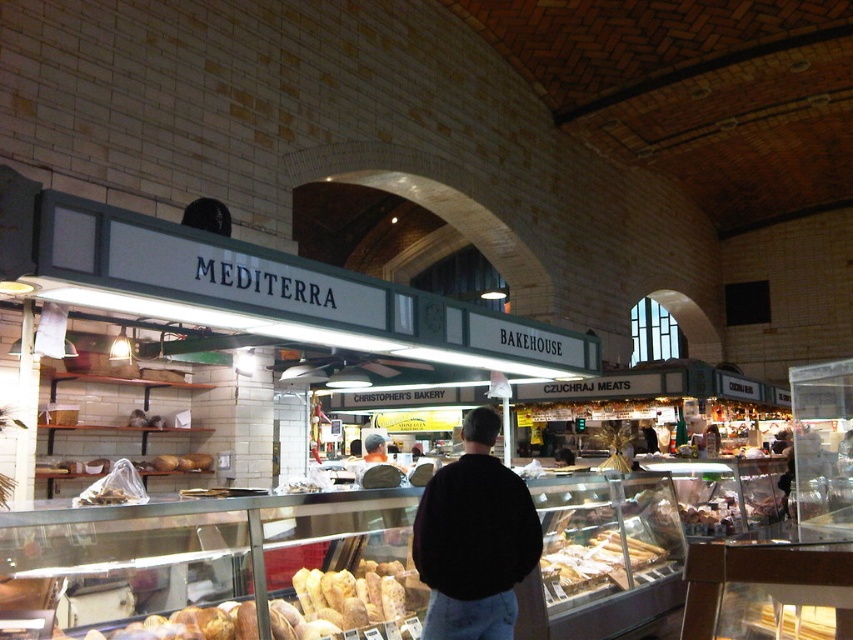
Does black sweater at center appear on the left side of golden crusty bread at center?

Incorrect, black sweater at center is not on the left side of golden crusty bread at center.

The image size is (853, 640). What do you see at coordinates (474, 538) in the screenshot?
I see `black sweater at center` at bounding box center [474, 538].

The image size is (853, 640). I want to click on black sweater at center, so click(474, 538).

Looking at this image, between black sweater at center and golden brown crusty bread at center, which one appears on the left side from the viewer's perspective?

black sweater at center is more to the left.

I want to click on black sweater at center, so click(474, 538).

Does point (418, 515) come in front of point (581, 580)?

Yes.

Image resolution: width=853 pixels, height=640 pixels. Identify the location of black sweater at center. (474, 538).

This screenshot has width=853, height=640. What are the coordinates of `golden crusty bread at center` in the screenshot? It's located at (349, 604).

Between point (126, 627) and point (590, 541), which one is positioned in front?

Point (126, 627) is more forward.

Locate an element on the screen. golden crusty bread at center is located at coordinates (349, 604).